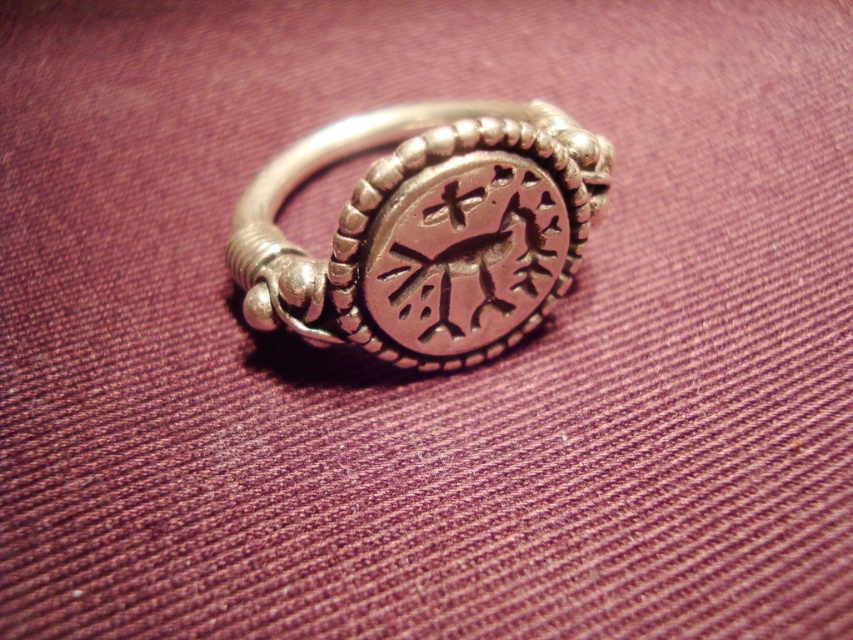
Can you confirm if polished silver ring at center is positioned below dark brown textured stone at center?

Actually, polished silver ring at center is above dark brown textured stone at center.

Can you confirm if polished silver ring at center is positioned to the left of dark brown textured stone at center?

Yes, polished silver ring at center is to the left of dark brown textured stone at center.

Is point (496, 257) positioned in front of point (453, 307)?

Yes, it is in front of point (453, 307).

Where is `polished silver ring at center`? The height and width of the screenshot is (640, 853). polished silver ring at center is located at coordinates (428, 230).